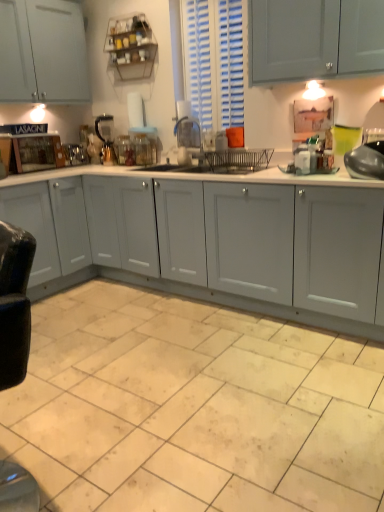
Question: Is wooden cutting board at left behind teal glass at upper right?

Choices:
 (A) no
 (B) yes

Answer: (B)

Question: Is wooden cutting board at left placed right next to teal glass at upper right?

Choices:
 (A) yes
 (B) no

Answer: (B)

Question: Considering the relative sizes of wooden cutting board at left and teal glass at upper right in the image provided, is wooden cutting board at left shorter than teal glass at upper right?

Choices:
 (A) no
 (B) yes

Answer: (A)

Question: Is wooden cutting board at left taller than teal glass at upper right?

Choices:
 (A) yes
 (B) no

Answer: (A)

Question: From the image's perspective, would you say wooden cutting board at left is shown under teal glass at upper right?

Choices:
 (A) no
 (B) yes

Answer: (A)

Question: Is wooden cutting board at left looking in the opposite direction of teal glass at upper right?

Choices:
 (A) yes
 (B) no

Answer: (B)

Question: From the image's perspective, is metallic silver coffee maker at center, marked as the 1th appliance in a left-to-right arrangement, located above beige ceramic tile at lower center?

Choices:
 (A) yes
 (B) no

Answer: (A)

Question: Can you confirm if metallic silver coffee maker at center, marked as the 1th appliance in a left-to-right arrangement, is taller than beige ceramic tile at lower center?

Choices:
 (A) yes
 (B) no

Answer: (A)

Question: From a real-world perspective, is metallic silver coffee maker at center, marked as the 5th appliance in a front-to-back arrangement, on top of beige ceramic tile at lower center?

Choices:
 (A) no
 (B) yes

Answer: (B)

Question: Can we say metallic silver coffee maker at center, which is the 5th appliance in right-to-left order, lies outside beige ceramic tile at lower center?

Choices:
 (A) yes
 (B) no

Answer: (A)

Question: From the image's perspective, is metallic silver coffee maker at center, marked as the 5th appliance in a front-to-back arrangement, beneath beige ceramic tile at lower center?

Choices:
 (A) yes
 (B) no

Answer: (B)

Question: Is beige ceramic tile at lower center at the back of metallic silver coffee maker at center, marked as the 1th appliance in a left-to-right arrangement?

Choices:
 (A) yes
 (B) no

Answer: (B)

Question: Can you confirm if shiny metallic pot at right, the fifth appliance in the back-to-front sequence, is smaller than teal glass at upper right?

Choices:
 (A) no
 (B) yes

Answer: (A)